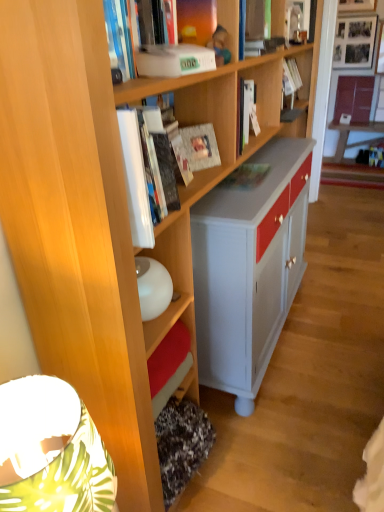
What do you see at coordinates (291, 76) in the screenshot?
I see `hardcover book at upper center, the 4th book from the left` at bounding box center [291, 76].

The width and height of the screenshot is (384, 512). Identify the location of white glossy book at upper center, marked as the fifth book in a right-to-left arrangement. (133, 30).

Describe the element at coordinates (173, 60) in the screenshot. I see `white matte paperback book at upper center, the 2th paperback book viewed from the back` at that location.

Locate an element on the screen. Image resolution: width=384 pixels, height=512 pixels. matte paper at center, the second paperback book positioned from the front is located at coordinates (200, 146).

From a real-world perspective, is matte paper at center, which is counted as the 1th paperback book, starting from the back, positioned above or below matte green book at center, the third book positioned from the front?

In terms of real-world spatial position, matte paper at center, which is counted as the 1th paperback book, starting from the back, is above matte green book at center, the third book positioned from the front.

Considering the sizes of objects matte paper at center, which is counted as the 1th paperback book, starting from the back, and matte green book at center, which is the third book in left-to-right order, in the image provided, who is smaller, matte paper at center, which is counted as the 1th paperback book, starting from the back, or matte green book at center, which is the third book in left-to-right order,?

matte paper at center, which is counted as the 1th paperback book, starting from the back.

What's the angular difference between matte paper at center, the second paperback book positioned from the front, and matte green book at center, placed as the 1th book when sorted from bottom to top,'s facing directions?

matte paper at center, the second paperback book positioned from the front, and matte green book at center, placed as the 1th book when sorted from bottom to top, are facing 32 degrees away from each other.

Considering the sizes of objects matte paper at center, the second paperback book positioned from the front, and matte green book at center, which is the third book in left-to-right order, in the image provided, who is taller, matte paper at center, the second paperback book positioned from the front, or matte green book at center, which is the third book in left-to-right order,?

With more height is matte paper at center, the second paperback book positioned from the front.

Does matte paper at center, the second paperback book positioned from the front, contain matte brown book at upper right, placed as the 5th book when sorted from front to back?

Definitely not — matte brown book at upper right, placed as the 5th book when sorted from front to back, is not inside matte paper at center, the second paperback book positioned from the front.

Is point (209, 143) closer or farther from the camera than point (339, 106)?

Point (209, 143) is closer to the camera than point (339, 106).

From the image's perspective, which is above, matte paper at center, which is counted as the 1th paperback book, starting from the back, or matte brown book at upper right, which ranks as the 1th book in right-to-left order?

matte brown book at upper right, which ranks as the 1th book in right-to-left order, is shown above in the image.

From a real-world perspective, is matte paper at center, the second paperback book positioned from the front, on top of matte brown book at upper right, which ranks as the 1th book in right-to-left order?

Indeed, from a real-world perspective, matte paper at center, the second paperback book positioned from the front, stands above matte brown book at upper right, which ranks as the 1th book in right-to-left order.

Considering the positions of point (300, 82) and point (123, 80), is point (300, 82) closer or farther from the camera than point (123, 80)?

Point (300, 82) is farther from the camera than point (123, 80).

Does hardcover book at upper center, the 4th book from the left, have a smaller size compared to white glossy book at upper center, marked as the fifth book in a right-to-left arrangement?

Yes, hardcover book at upper center, the 4th book from the left, is smaller than white glossy book at upper center, marked as the fifth book in a right-to-left arrangement.

At what (x,y) coordinates should I click in order to perform the action: click on book that is the 3rd object located behind the white glossy book at upper center, the first book positioned from the left. Please return your answer as a coordinate pair (x, y). The width and height of the screenshot is (384, 512). Looking at the image, I should click on (291, 76).

Is white glossy cabinet at upper right shorter than white matte book at upper center, the 4th book in the back-to-front sequence?

No, white glossy cabinet at upper right is not shorter than white matte book at upper center, the 4th book in the back-to-front sequence.

Is white glossy cabinet at upper right not close to white matte book at upper center, which is the third book in top-to-bottom order?

Absolutely, white glossy cabinet at upper right is distant from white matte book at upper center, which is the third book in top-to-bottom order.

Is the position of white glossy cabinet at upper right less distant than that of white matte book at upper center, which is the third book in top-to-bottom order?

No, white glossy cabinet at upper right is further to the viewer.

Considering the relative sizes of white glossy cabinet at upper right and white matte book at upper center, arranged as the 2th book when viewed from the front, in the image provided, is white glossy cabinet at upper right bigger than white matte book at upper center, arranged as the 2th book when viewed from the front,?

Yes.

Considering the positions of point (339, 124) and point (327, 133), is point (339, 124) closer or farther from the camera than point (327, 133)?

Point (339, 124) appears to be farther away from the viewer than point (327, 133).

Considering the relative sizes of white glossy desk at upper right and white glossy cabinet at upper right in the image provided, is white glossy desk at upper right thinner than white glossy cabinet at upper right?

Incorrect, the width of white glossy desk at upper right is not less than that of white glossy cabinet at upper right.

Is there a large distance between white glossy desk at upper right and white glossy cabinet at upper right?

That's not correct — white glossy desk at upper right is a little close to white glossy cabinet at upper right.

Considering the relative positions of white glossy desk at upper right and white glossy cabinet at upper right in the image provided, is white glossy desk at upper right in front of white glossy cabinet at upper right?

No, the depth of white glossy desk at upper right is greater than that of white glossy cabinet at upper right.

Is white matte paperback book at upper center, the 2th paperback book viewed from the back, in front of or behind white matte book at upper center, the 4th book in the back-to-front sequence, in the image?

white matte paperback book at upper center, the 2th paperback book viewed from the back, is in front of white matte book at upper center, the 4th book in the back-to-front sequence.

Is point (172, 69) closer or farther from the camera than point (187, 34)?

Point (172, 69).

In the scene shown: Which of these two, white matte paperback book at upper center, the 2th paperback book viewed from the back, or white matte book at upper center, which is the third book in top-to-bottom order, is thinner?

white matte paperback book at upper center, the 2th paperback book viewed from the back, is thinner.

Is white glossy cabinet at upper right far away from matte green book at center, which is the third book in left-to-right order?

Absolutely, white glossy cabinet at upper right is distant from matte green book at center, which is the third book in left-to-right order.

Does white glossy cabinet at upper right contain matte green book at center, placed as the 1th book when sorted from bottom to top?

Actually, matte green book at center, placed as the 1th book when sorted from bottom to top, is outside white glossy cabinet at upper right.

Looking at this image, considering the positions of objects white glossy cabinet at upper right and matte green book at center, the 3th book viewed from the back, in the image provided, who is more to the right, white glossy cabinet at upper right or matte green book at center, the 3th book viewed from the back,?

white glossy cabinet at upper right.

How much distance is there between white glossy cabinet at upper right and matte green book at center, which is the third book in left-to-right order?

4.08 meters.

From the image's perspective, count 1st paperback books upward from the matte green book at center, the 3th book when ordered from right to left, and point to it. Please provide its 2D coordinates.

[(200, 146)]

I want to click on the 1st paperback book to the left when counting from the matte brown book at upper right, which is counted as the 1th book, starting from the back, so click(x=200, y=146).

When comparing their distances from matte brown book at upper right, which ranks as the 1th book in right-to-left order, does white matte paperback book at upper center, the 2th paperback book viewed from the back, or white glossy book at upper center, the first book positioned from the left, seem further?

Among the two, white glossy book at upper center, the first book positioned from the left, is located further to matte brown book at upper right, which ranks as the 1th book in right-to-left order.

From the image, which object appears to be nearer to white matte paperback book at upper center, which is counted as the first paperback book, starting from the front, white glossy book at upper center, positioned as the 4th book in top-to-bottom order, or hardcover book at upper center, marked as the second book in a top-to-bottom arrangement?

white glossy book at upper center, positioned as the 4th book in top-to-bottom order, lies closer to white matte paperback book at upper center, which is counted as the first paperback book, starting from the front, than the other object.

From the image, which object appears to be nearer to white glossy desk at upper right, white glossy book at upper center, the first book positioned from the left, or matte green book at center, the 3th book when ordered from right to left?

matte green book at center, the 3th book when ordered from right to left, lies closer to white glossy desk at upper right than the other object.

Looking at this image, from the image, which object appears to be nearer to white matte paperback book at upper center, which is counted as the first paperback book, starting from the front, white glossy cabinet at upper right or matte paper at center, which is counted as the 1th paperback book, starting from the back?

matte paper at center, which is counted as the 1th paperback book, starting from the back, is positioned closer to the anchor white matte paperback book at upper center, which is counted as the first paperback book, starting from the front.

Which object lies nearer to the anchor point matte green book at center, placed as the 1th book when sorted from bottom to top, matte paper at center, which is counted as the 1th paperback book, starting from the back, or white glossy desk at upper right?

Based on the image, matte paper at center, which is counted as the 1th paperback book, starting from the back, appears to be nearer to matte green book at center, placed as the 1th book when sorted from bottom to top.

Estimate the real-world distances between objects in this image. Which object is closer to hardcover book at upper center, placed as the 2th book when sorted from right to left, matte brown book at upper right, which ranks as the first book in top-to-bottom order, or matte paper at center, the second paperback book positioned from the front?

Among the two, matte paper at center, the second paperback book positioned from the front, is located nearer to hardcover book at upper center, placed as the 2th book when sorted from right to left.

From the image, which object appears to be nearer to white glossy book at upper center, marked as the fifth book in a right-to-left arrangement, white matte book at upper center, arranged as the 3th book when ordered from the bottom, or white glossy desk at upper right?

The object closer to white glossy book at upper center, marked as the fifth book in a right-to-left arrangement, is white matte book at upper center, arranged as the 3th book when ordered from the bottom.

When comparing their distances from hardcover book at upper center, the 4th book from the left, does white glossy book at upper center, marked as the fifth book in a right-to-left arrangement, or matte brown book at upper right, which ranks as the 1th book in right-to-left order, seem closer?

white glossy book at upper center, marked as the fifth book in a right-to-left arrangement, lies closer to hardcover book at upper center, the 4th book from the left, than the other object.

This screenshot has width=384, height=512. I want to click on cabinet located between white glossy book at upper center, positioned as the 4th book in top-to-bottom order, and white glossy desk at upper right in the depth direction, so click(352, 70).

Locate an element on the screen. Image resolution: width=384 pixels, height=512 pixels. paperback book between white matte book at upper center, which is the third book in top-to-bottom order, and matte brown book at upper right, which is counted as the 1th book, starting from the back, along the z-axis is located at coordinates (200, 146).

Locate an element on the screen. Image resolution: width=384 pixels, height=512 pixels. desk located between white glossy cabinet at upper right and matte brown book at upper right, placed as the 5th book when sorted from left to right, in the depth direction is located at coordinates (356, 142).

The height and width of the screenshot is (512, 384). Identify the location of paperback book positioned between white matte paperback book at upper center, which is counted as the first paperback book, starting from the front, and matte brown book at upper right, which is counted as the 1th book, starting from the back, from near to far. (200, 146).